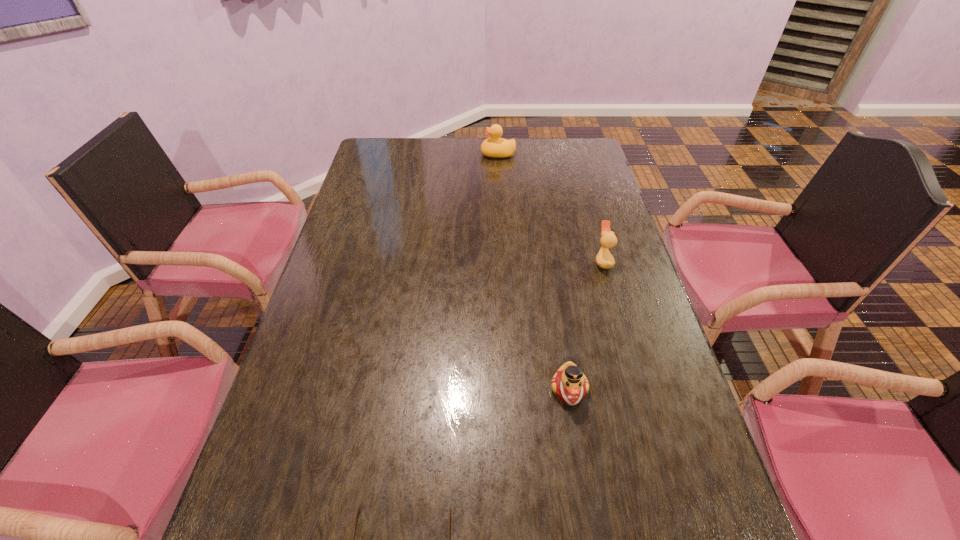
Identify the location of free space between the second farthest object and the leftmost duck. (550, 208).

Identify the location of free space between the third object from right to left and the third tallest object. (534, 272).

Identify the location of unoccupied position between the rightmost duck and the nearest duck. This screenshot has height=540, width=960. point(586,326).

Where is `vacant region between the second nearest object and the leftmost duck`? Image resolution: width=960 pixels, height=540 pixels. vacant region between the second nearest object and the leftmost duck is located at coordinates (534, 272).

This screenshot has height=540, width=960. What are the coordinates of `free space between the farthest object and the shortest duck` in the screenshot? It's located at (534, 272).

Select which object is the closest to the second object from left to right. Please provide its 2D coordinates. Your answer should be formatted as a tuple, i.e. [(x, y)], where the tuple contains the x and y coordinates of a point satisfying the conditions above.

[(604, 259)]

Locate an element on the screen. This screenshot has height=540, width=960. object identified as the second closest to the shortest object is located at coordinates (604, 259).

Select which duck is the closest to the shortest object. Please provide its 2D coordinates. Your answer should be formatted as a tuple, i.e. [(x, y)], where the tuple contains the x and y coordinates of a point satisfying the conditions above.

[(569, 383)]

Where is `duck object that ranks as the third closest to the nearest object`? The width and height of the screenshot is (960, 540). duck object that ranks as the third closest to the nearest object is located at coordinates (496, 147).